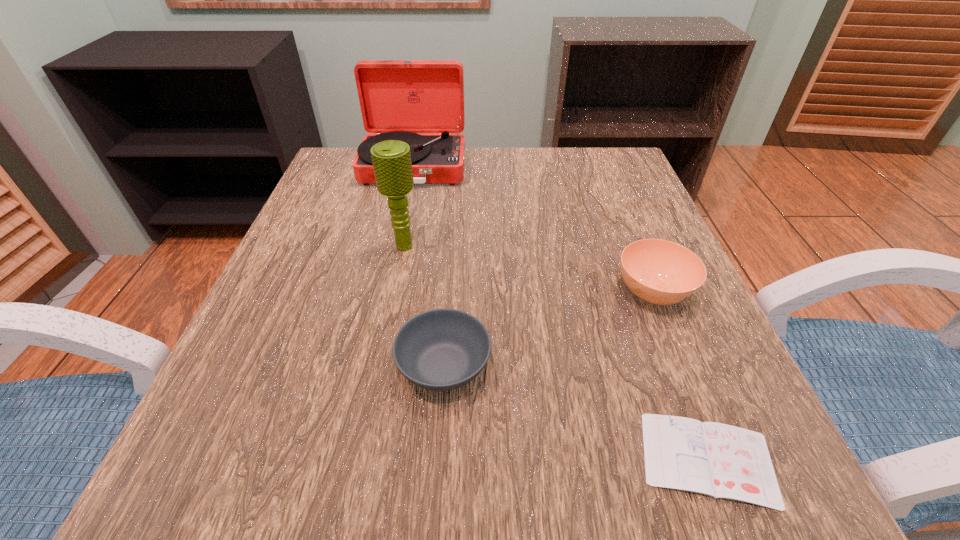
At what (x,y) coordinates should I click in order to perform the action: click on the farthest object. Please return your answer as a coordinate pair (x, y). This screenshot has height=540, width=960. Looking at the image, I should click on (398, 98).

Image resolution: width=960 pixels, height=540 pixels. Identify the location of the fourth nearest object. (391, 159).

You are a GUI agent. You are given a task and a screenshot of the screen. Output one action in this format:
    pyautogui.click(x=<x>, y=<y>)
    Task: Click on the farther soup bowl
    This screenshot has height=540, width=960.
    Given the screenshot: What is the action you would take?
    pyautogui.click(x=661, y=272)

Find the location of a particular element. the taller soup bowl is located at coordinates (661, 272).

Image resolution: width=960 pixels, height=540 pixels. What are the coordinates of `the left soup bowl` in the screenshot? It's located at (443, 349).

At what (x,y) coordinates should I click in order to perform the action: click on the nearer soup bowl. Please return your answer as a coordinate pair (x, y). This screenshot has height=540, width=960. Looking at the image, I should click on (443, 349).

Where is `the shortest object`? This screenshot has height=540, width=960. the shortest object is located at coordinates (723, 461).

Where is `the nearest object`? The image size is (960, 540). the nearest object is located at coordinates (723, 461).

Locate an element on the screen. vacant region located 0.220m on the front-facing side of the farthest object is located at coordinates (396, 251).

The height and width of the screenshot is (540, 960). I want to click on free region located 0.080m on the back of the microphone, so click(x=411, y=212).